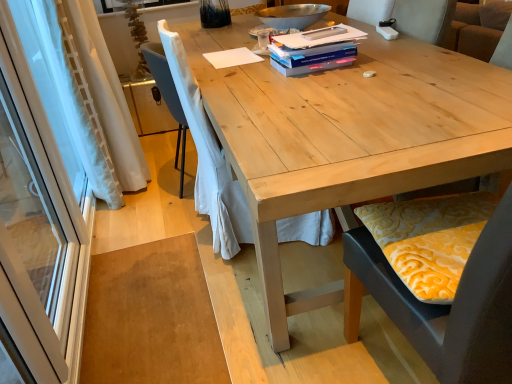
The width and height of the screenshot is (512, 384). Identify the location of free spot above blue matte paperback book at upper center, the 2th paperback book ordered from the bottom (from a real-world perspective). (313, 37).